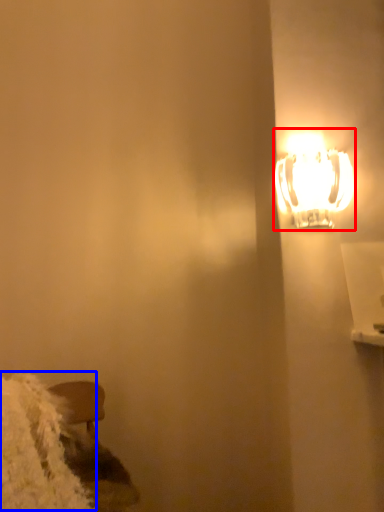
Question: Which point is further to the camera, lamp (highlighted by a red box) or wide (highlighted by a blue box)?

Choices:
 (A) lamp
 (B) wide

Answer: (A)